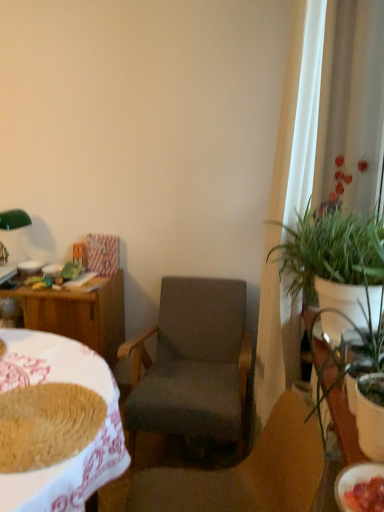
Question: From the image's perspective, is white glossy bowl at left, which is the second bowl from front to back, located above or below white sheer curtain at right?

Choices:
 (A) below
 (B) above

Answer: (A)

Question: In the image, is white glossy bowl at left, which appears as the 1th bowl when viewed from the back, positioned in front of or behind white sheer curtain at right?

Choices:
 (A) front
 (B) behind

Answer: (B)

Question: Which of these objects is positioned farthest from the white glossy table at right, placed as the 2th table when sorted from left to right?

Choices:
 (A) white glossy bowl at left, which is counted as the first bowl, starting from the top
 (B) baked brown bread at lower left
 (C) wooden table at left, acting as the 1th table starting from the left
 (D) white sheer curtain at right
 (E) dark gray fabric chair at center, which ranks as the 2th chair in front-to-back order

Answer: (A)

Question: Considering the real-world distances, which object is farthest from the white sheer curtain at right?

Choices:
 (A) wooden desk at left
 (B) white glossy bowl at left, which ranks as the 2th bowl in bottom-to-top order
 (C) wooden table at left, acting as the 1th table starting from the left
 (D) dark gray fabric chair at center, placed as the 1th chair when sorted from back to front
 (E) matte white bowl at lower right, which is the first bowl from right to left

Answer: (B)